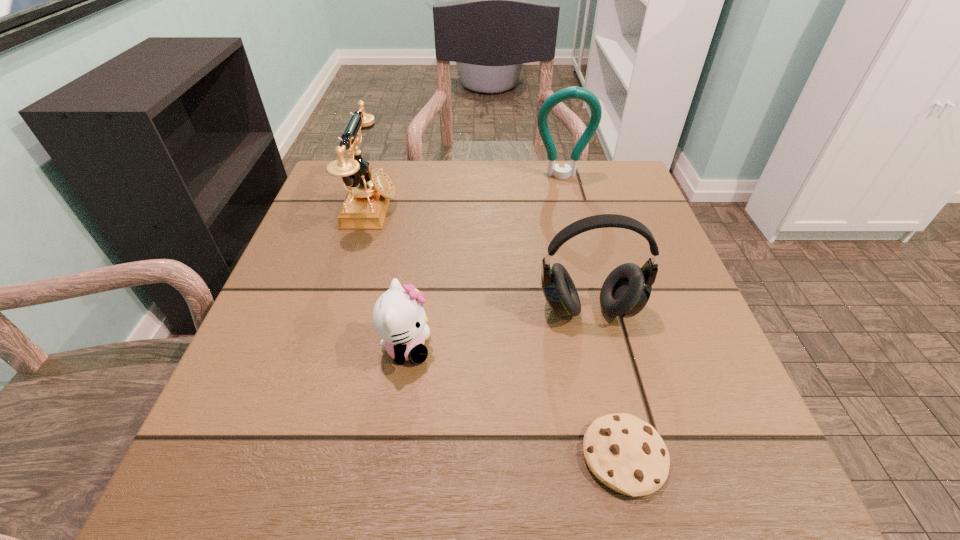
At what (x,y) coordinates should I click in order to perform the action: click on bottle opener. Please return your answer as a coordinate pair (x, y). This screenshot has height=540, width=960. Looking at the image, I should click on (575, 92).

Where is `telephone`? This screenshot has width=960, height=540. telephone is located at coordinates (365, 206).

Locate an element on the screen. This screenshot has height=540, width=960. headset is located at coordinates (625, 292).

Locate an element on the screen. The image size is (960, 540). kitten is located at coordinates (399, 319).

Where is `the fourth object from right to left`? The height and width of the screenshot is (540, 960). the fourth object from right to left is located at coordinates (399, 319).

At what (x,y) coordinates should I click in order to perform the action: click on cookie. Please return your answer as a coordinate pair (x, y). The width and height of the screenshot is (960, 540). Looking at the image, I should click on (625, 453).

Where is `the shortest object`? the shortest object is located at coordinates (625, 453).

Image resolution: width=960 pixels, height=540 pixels. In order to click on free point located 0.400m at the jaws of the bottle opener in this screenshot , I will do `click(593, 302)`.

At what (x,y) coordinates should I click in order to perform the action: click on vacant space located on the dial of the telephone. Please return your answer as a coordinate pair (x, y). Looking at the image, I should click on (444, 207).

The image size is (960, 540). Find the location of `free location located 0.080m on the ear cups of the headset`. free location located 0.080m on the ear cups of the headset is located at coordinates (603, 369).